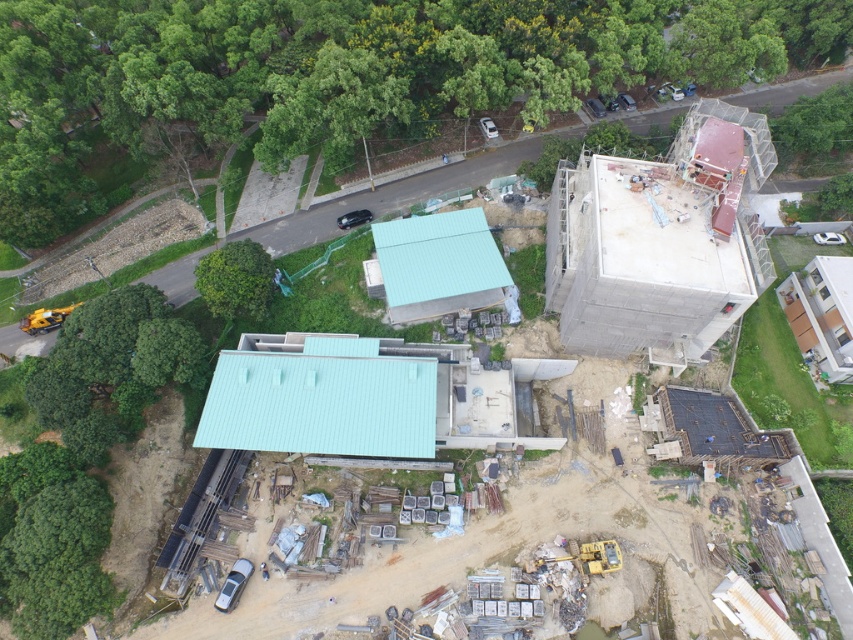
Question: Is green leafy tree at upper center to the left of green leafy tree at center from the viewer's perspective?

Choices:
 (A) no
 (B) yes

Answer: (A)

Question: Is green leafy tree at upper center bigger than green leafy tree at center?

Choices:
 (A) no
 (B) yes

Answer: (B)

Question: Is green leafy tree at upper left thinner than green leafy tree at upper center?

Choices:
 (A) yes
 (B) no

Answer: (B)

Question: Which point appears farthest from the camera in this image?

Choices:
 (A) (x=154, y=35)
 (B) (x=216, y=282)
 (C) (x=288, y=157)

Answer: (A)

Question: Which object is farther from the camera taking this photo?

Choices:
 (A) green leafy tree at upper left
 (B) green leafy tree at upper center

Answer: (A)

Question: Which point is farther to the camera?

Choices:
 (A) green leafy tree at upper center
 (B) green leafy tree at center
 (C) green leafy tree at upper left

Answer: (C)